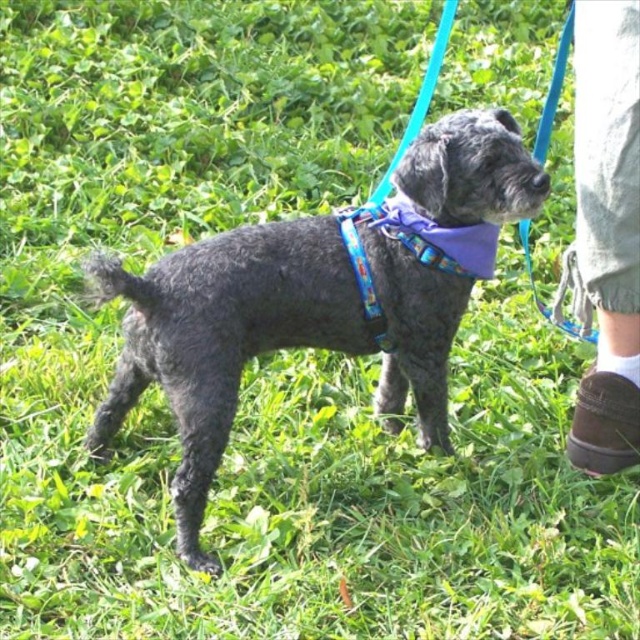
Looking at this image, can you confirm if shaggy gray dog at center is smaller than brown suede shoe at lower right?

Incorrect, shaggy gray dog at center is not smaller in size than brown suede shoe at lower right.

Between shaggy gray dog at center and brown suede shoe at lower right, which one has more height?

brown suede shoe at lower right

Describe the element at coordinates (321, 298) in the screenshot. This screenshot has width=640, height=640. I see `shaggy gray dog at center` at that location.

Locate an element on the screen. shaggy gray dog at center is located at coordinates (321, 298).

Who is more distant from viewer, (625, 336) or (424, 221)?

The point (625, 336) is behind.

Can you confirm if brown suede shoe at lower right is smaller than purple fabric neckband at center?

No, brown suede shoe at lower right is not smaller than purple fabric neckband at center.

Which is in front, point (579, 172) or point (388, 214)?

Positioned in front is point (388, 214).

Find the location of a particular element. The image size is (640, 640). brown suede shoe at lower right is located at coordinates (608, 230).

Is shaggy gray dog at center to the left of purple fabric neckband at center from the viewer's perspective?

Indeed, shaggy gray dog at center is positioned on the left side of purple fabric neckband at center.

Does shaggy gray dog at center appear under purple fabric neckband at center?

Correct, shaggy gray dog at center is located below purple fabric neckband at center.

The height and width of the screenshot is (640, 640). Find the location of `shaggy gray dog at center`. shaggy gray dog at center is located at coordinates (321, 298).